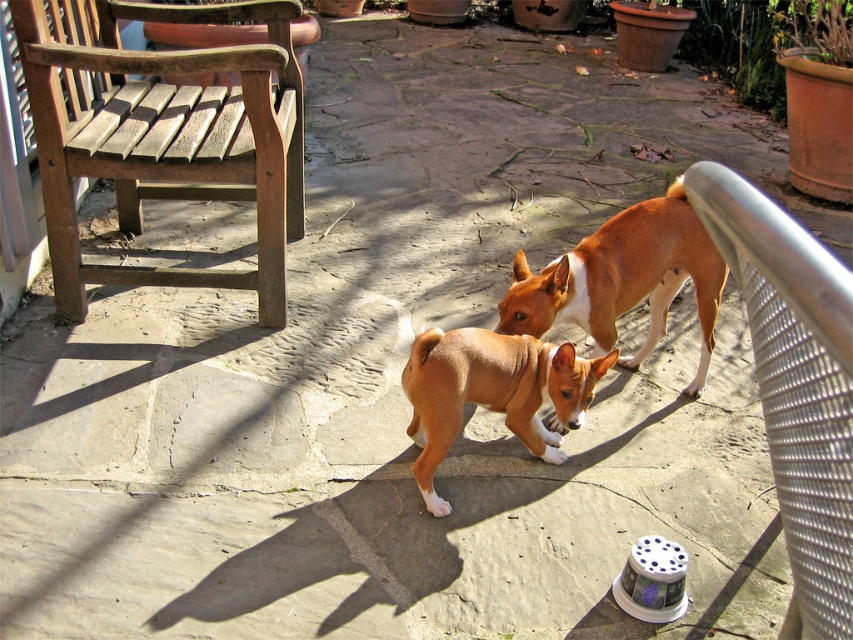
Is silver metallic rail at upper right to the right of brown smooth dog at center from the viewer's perspective?

In fact, silver metallic rail at upper right is to the left of brown smooth dog at center.

Is silver metallic rail at upper right thinner than brown smooth dog at center?

Correct, silver metallic rail at upper right's width is less than brown smooth dog at center's.

What do you see at coordinates (795, 385) in the screenshot?
I see `silver metallic rail at upper right` at bounding box center [795, 385].

The image size is (853, 640). Find the location of `silver metallic rail at upper right`. silver metallic rail at upper right is located at coordinates (795, 385).

Is brown smooth dog at center closer to the viewer compared to brown furry dog at center?

No.

Measure the distance between point (639, 225) and camera.

Point (639, 225) is 7.34 feet from camera.

Locate an element on the screen. brown smooth dog at center is located at coordinates (624, 280).

Is silver metallic rail at upper right thinner than brown furry dog at center?

Correct, silver metallic rail at upper right's width is less than brown furry dog at center's.

Between point (809, 525) and point (491, 356), which one is positioned in front?

Positioned in front is point (809, 525).

Does point (724, 184) come behind point (479, 394)?

No, it is not.

Locate an element on the screen. silver metallic rail at upper right is located at coordinates (795, 385).